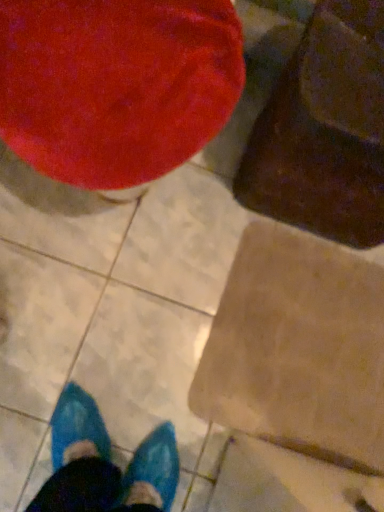
Question: From the image's perspective, relative to velvet red bean bag chair at upper left, acting as the second bean bag chair starting from the right, is brown cardboard at lower right above or below?

Choices:
 (A) above
 (B) below

Answer: (B)

Question: Based on their positions, is brown cardboard at lower right located to the left or right of velvet red bean bag chair at upper left, the first bean bag chair viewed from the left?

Choices:
 (A) left
 (B) right

Answer: (B)

Question: Based on their relative distances, which object is nearer to the brown cardboard at lower right?

Choices:
 (A) velvety brown bean bag chair at upper right, placed as the 1th bean bag chair when sorted from right to left
 (B) velvet red bean bag chair at upper left, the first bean bag chair viewed from the left

Answer: (A)

Question: Which of these objects is positioned closest to the velvety brown bean bag chair at upper right, placed as the 1th bean bag chair when sorted from right to left?

Choices:
 (A) brown cardboard at lower right
 (B) velvet red bean bag chair at upper left, the first bean bag chair viewed from the left

Answer: (B)